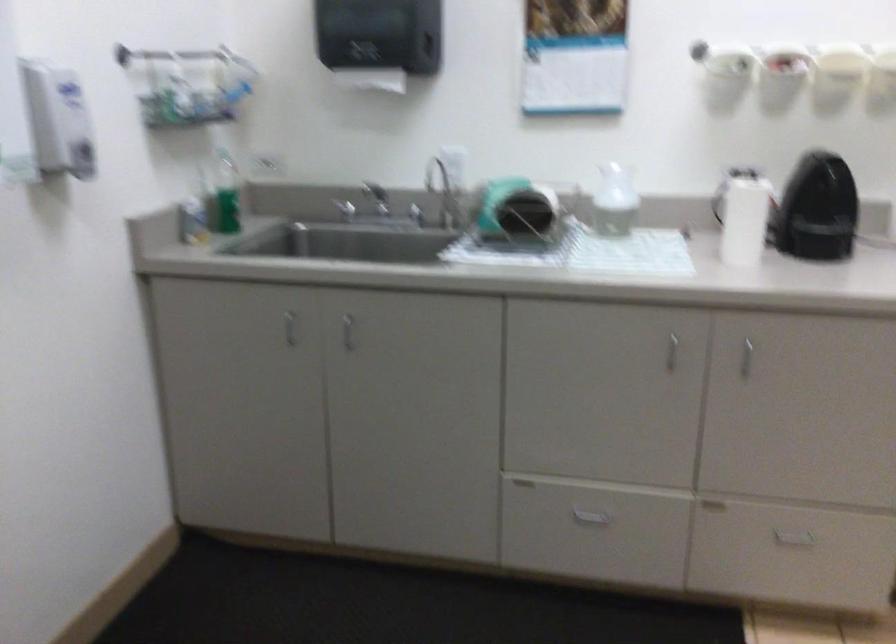
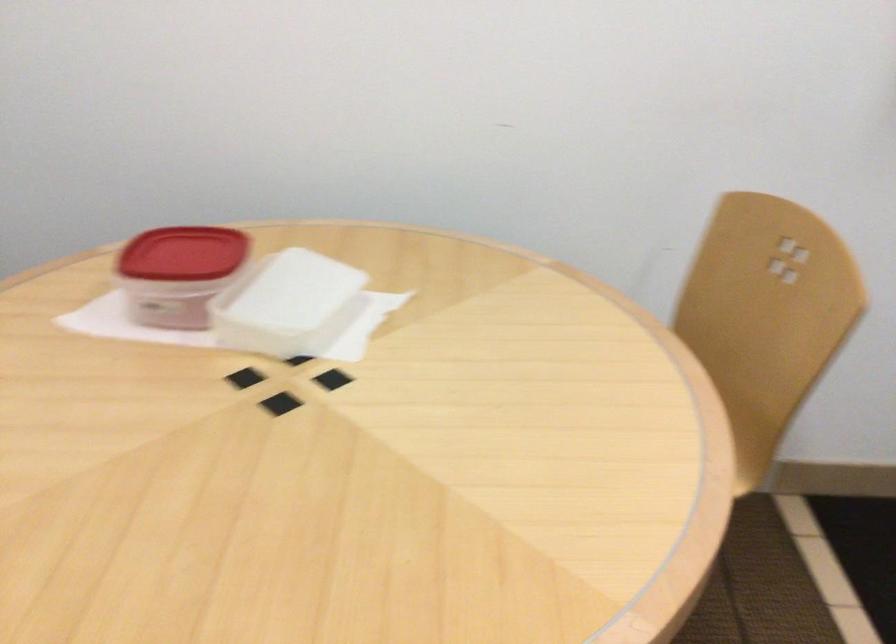
Based on the continuous images, in which direction is the camera rotating?

The camera rotated toward left-down.